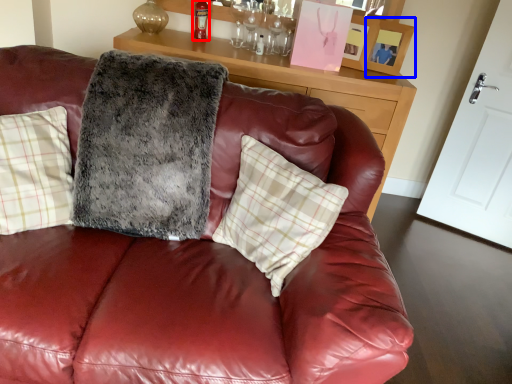
Question: Which object is further to the camera taking this photo, alcohol (highlighted by a red box) or picture frame (highlighted by a blue box)?

Choices:
 (A) alcohol
 (B) picture frame

Answer: (A)